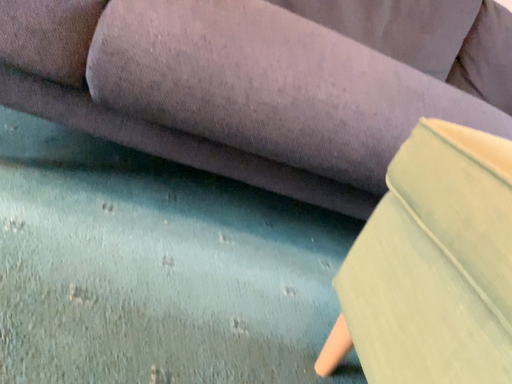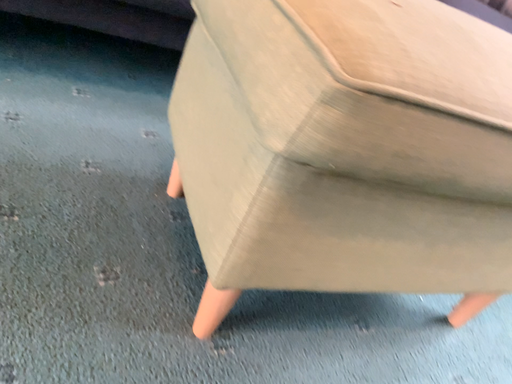
Question: How did the camera likely rotate when shooting the video?

Choices:
 (A) rotated downward
 (B) rotated upward

Answer: (A)